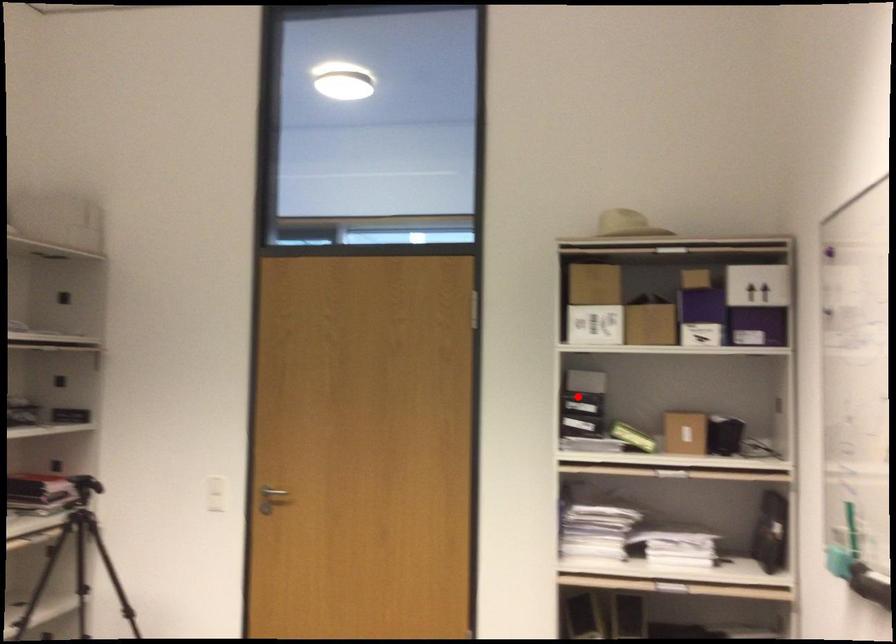
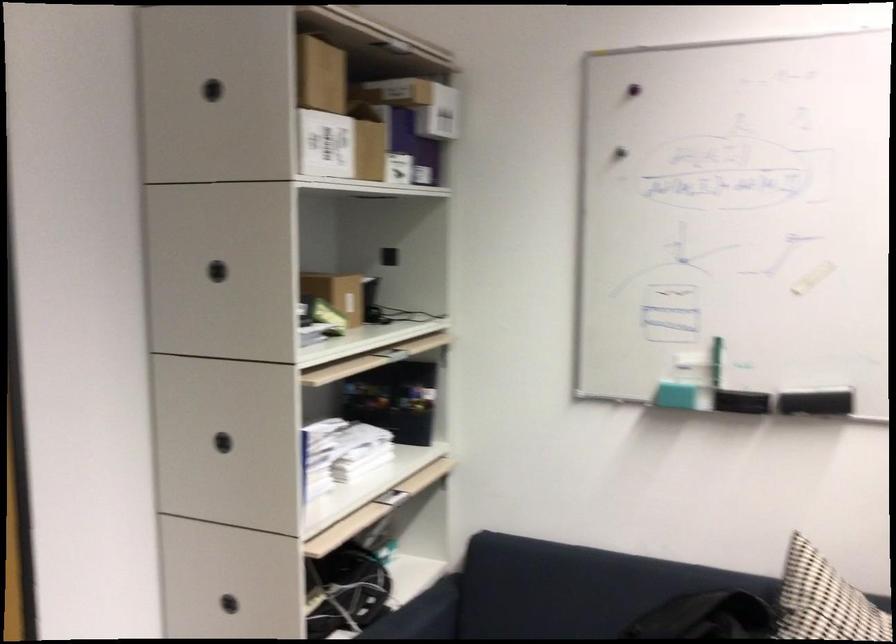
Question: I am providing you with two images of the same scene from different viewpoints. Image1 has a red point marked. In image2, the corresponding 3D location appears at what relative position? Reply with the corresponding letter.

Choices:
 (A) Closer
 (B) Farther

Answer: (A)